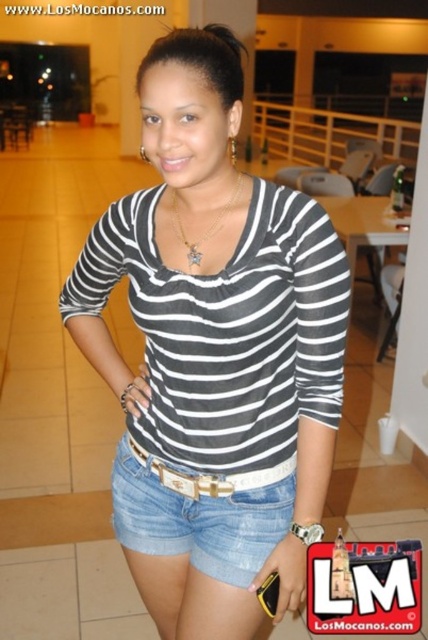
Question: Which point is farther to the camera?

Choices:
 (A) (x=166, y=525)
 (B) (x=208, y=49)

Answer: (A)

Question: Is striped fabric shirt at center bigger than denim shorts at center?

Choices:
 (A) yes
 (B) no

Answer: (A)

Question: Is striped fabric shirt at center to the left of denim shorts at center from the viewer's perspective?

Choices:
 (A) yes
 (B) no

Answer: (A)

Question: Among these points, which one is nearest to the camera?

Choices:
 (A) (157, 250)
 (B) (222, 499)

Answer: (A)

Question: Is striped fabric shirt at center further to the viewer compared to denim shorts at center?

Choices:
 (A) no
 (B) yes

Answer: (A)